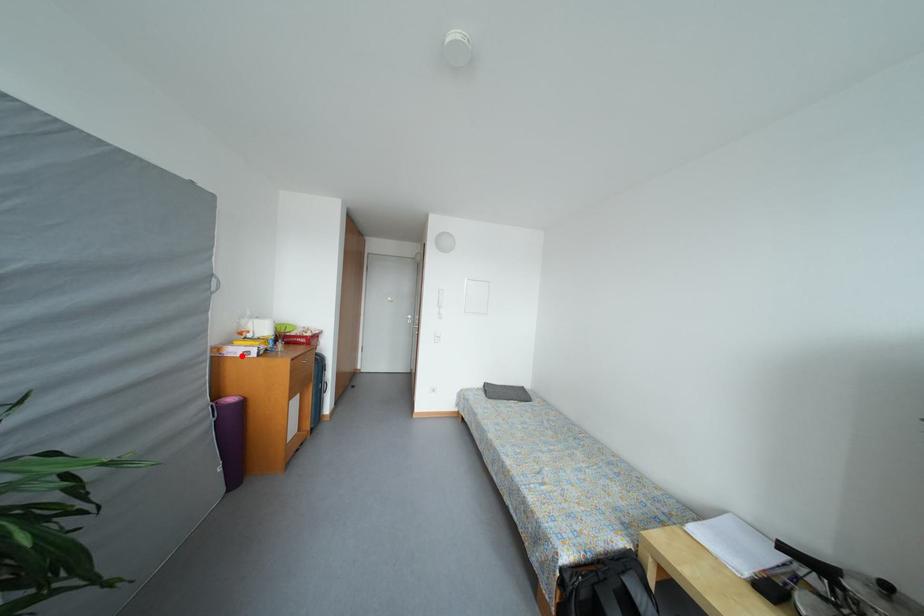
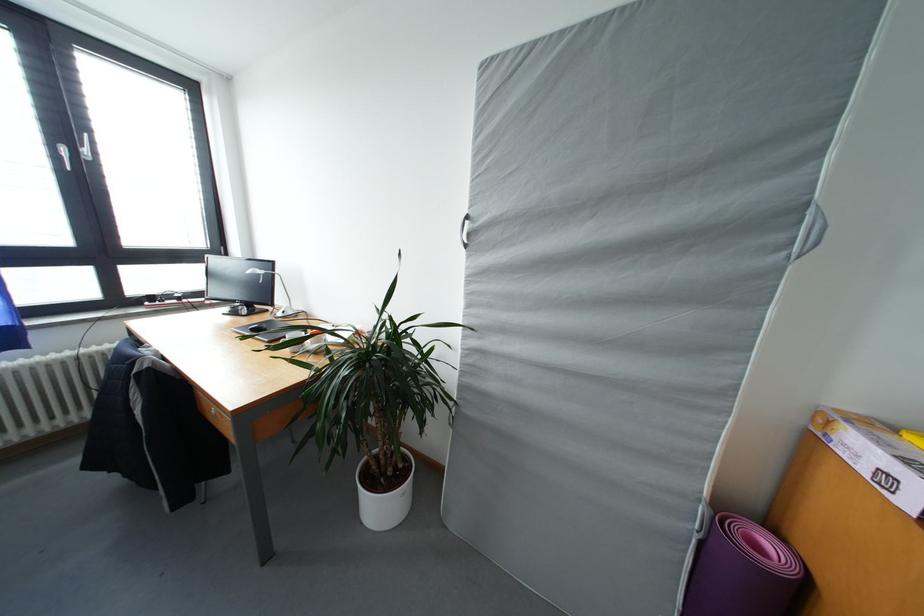
Find the pixel in the second image that matches the highlighted location in the first image.

(868, 455)